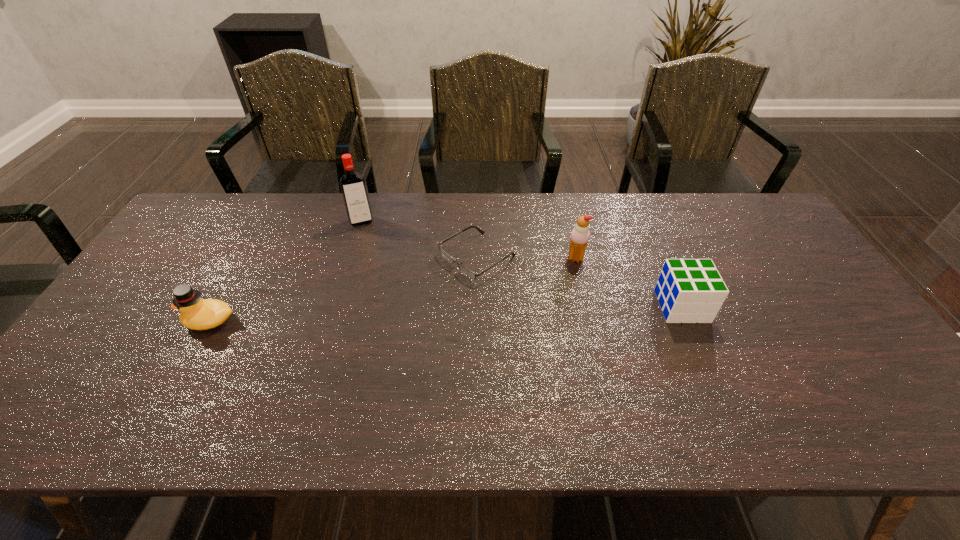
You are a GUI agent. You are given a task and a screenshot of the screen. Output one action in this format:
    pyautogui.click(x=<x>, y=<y>)
    Task: Click on the duck
    
    Given the screenshot: What is the action you would take?
    pyautogui.click(x=196, y=314)

What are the coordinates of `the rightmost object` in the screenshot? It's located at (688, 290).

Identify the location of the third object from right to left. The width and height of the screenshot is (960, 540). (467, 272).

The width and height of the screenshot is (960, 540). Find the location of `spectacles`. spectacles is located at coordinates (467, 272).

Where is `icecream`? icecream is located at coordinates [580, 235].

Locate an element on the screen. the second object from right to left is located at coordinates point(580,235).

This screenshot has width=960, height=540. Find the location of `the tallest object`. the tallest object is located at coordinates (352, 184).

Identify the location of vodka. (352, 184).

Where is `vacant space located on the front-facing side of the leftmost object`? vacant space located on the front-facing side of the leftmost object is located at coordinates (122, 321).

Identify the location of vacant area located 0.170m on the front-facing side of the leftmost object. (118, 321).